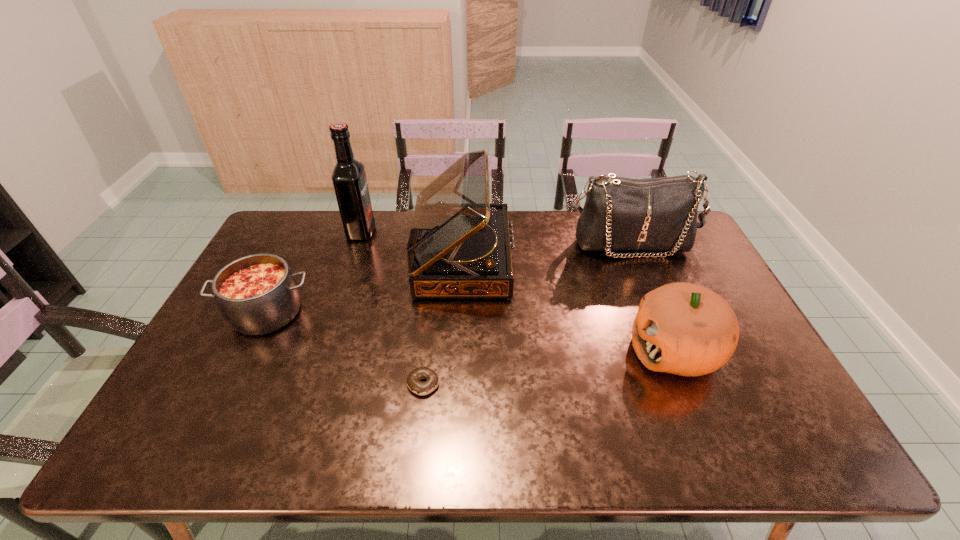
The height and width of the screenshot is (540, 960). Find the location of `vacant space positioned at the front of the handbag with chain and zipper`. vacant space positioned at the front of the handbag with chain and zipper is located at coordinates (643, 276).

Where is `vacant space located on the face of the fourth tallest object`? Image resolution: width=960 pixels, height=540 pixels. vacant space located on the face of the fourth tallest object is located at coordinates (565, 350).

Locate an element on the screen. This screenshot has height=540, width=960. free region located on the face of the fourth tallest object is located at coordinates (506, 350).

Identify the location of vacant space positioned 0.090m on the face of the fourth tallest object. The height and width of the screenshot is (540, 960). (595, 350).

The image size is (960, 540). I want to click on free region located 0.050m on the right of the second shortest object, so click(x=331, y=313).

Where is `vacant space located 0.370m on the back of the doughnut`? vacant space located 0.370m on the back of the doughnut is located at coordinates (436, 275).

Locate an element on the screen. This screenshot has width=960, height=540. liquor present at the far edge is located at coordinates (349, 180).

Image resolution: width=960 pixels, height=540 pixels. What are the coordinates of `record player that is at the far edge` in the screenshot? It's located at (459, 246).

Identify the location of handbag that is at the far edge. (620, 214).

This screenshot has width=960, height=540. I want to click on object located in the left edge section of the desktop, so click(258, 294).